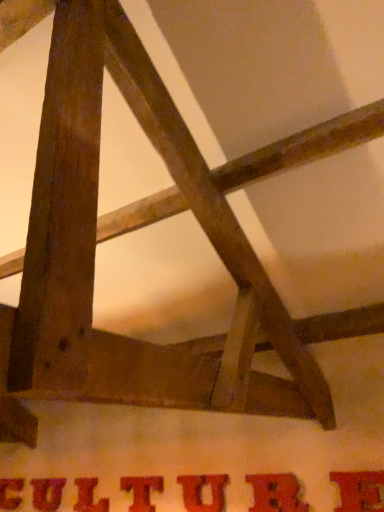
Find the location of a particular element. This screenshot has height=512, width=384. matte red letter at center, which is the sixth letter from left to right is located at coordinates (276, 493).

Measure the distance between point (228, 478) and camera.

Point (228, 478) and camera are 8.71 feet apart from each other.

The width and height of the screenshot is (384, 512). I want to click on matte brown letter t at center, which appears as the 4th letter when viewed from the right, so click(x=142, y=490).

In the scene shown: Measure the distance between point (81,508) and camera.

The depth of point (81,508) is 3.16 meters.

At what (x,y) coordinates should I click in order to perform the action: click on matte red letter at center, marked as the second letter in a left-to-right arrangement. Please return your answer as a coordinate pair (x, y). Looking at the image, I should click on (47, 493).

This screenshot has height=512, width=384. What are the coordinates of `matte red letter at center, which is the sixth letter from left to right` in the screenshot? It's located at (276, 493).

Looking at their sizes, would you say matte brown letter at center, arranged as the 7th letter when viewed from the right, is wider or thinner than matte red letter at center, which is the sixth letter from left to right?

In the image, matte brown letter at center, arranged as the 7th letter when viewed from the right, appears to be wider than matte red letter at center, which is the sixth letter from left to right.

How many degrees apart are the facing directions of matte brown letter at center, which is the first letter from left to right, and matte red letter at center, which is the second letter in right-to-left order?

0.00771 degrees.

From the image's perspective, which letter is the 5th one below the matte red letter at center, which is the second letter in right-to-left order? Please provide its 2D coordinates.

[(10, 493)]

Can you see matte red letter at lower right, positioned as the seventh letter in left-to-right order, touching matte brown letter t at center, the 4th letter in the left-to-right sequence?

No, matte red letter at lower right, positioned as the seventh letter in left-to-right order, is not beside matte brown letter t at center, the 4th letter in the left-to-right sequence.

Choose the correct answer: Is matte red letter at lower right, which is the 1th letter from right to left, inside matte brown letter t at center, which appears as the 4th letter when viewed from the right, or outside it?

matte red letter at lower right, which is the 1th letter from right to left, is outside matte brown letter t at center, which appears as the 4th letter when viewed from the right.

In terms of height, does matte red letter at lower right, which is the 1th letter from right to left, look taller or shorter compared to matte brown letter t at center, which appears as the 4th letter when viewed from the right?

In the image, matte red letter at lower right, which is the 1th letter from right to left, appears to be taller than matte brown letter t at center, which appears as the 4th letter when viewed from the right.

Can you tell me how much matte red letter at lower right, which is the 1th letter from right to left, and matte brown letter t at center, the 4th letter in the left-to-right sequence, differ in facing direction?

The facing directions of matte red letter at lower right, which is the 1th letter from right to left, and matte brown letter t at center, the 4th letter in the left-to-right sequence, are 0.00142 degrees apart.

Can you tell me how much matte red letter at center, the sixth letter positioned from the right, and matte brown letter t at center, which appears as the 4th letter when viewed from the right, differ in facing direction?

The facing directions of matte red letter at center, the sixth letter positioned from the right, and matte brown letter t at center, which appears as the 4th letter when viewed from the right, are 0.00757 degrees apart.

Which object is wider, matte red letter at center, marked as the second letter in a left-to-right arrangement, or matte brown letter t at center, which appears as the 4th letter when viewed from the right?

With larger width is matte brown letter t at center, which appears as the 4th letter when viewed from the right.

Locate an element on the screen. Image resolution: width=384 pixels, height=512 pixels. letter that is the 2nd object located below the matte brown letter t at center, the 4th letter in the left-to-right sequence (from the image's perspective) is located at coordinates point(47,493).

Is matte red letter at center, the sixth letter positioned from the right, turned away from matte brown letter t at center, which appears as the 4th letter when viewed from the right?

That's not correct — matte red letter at center, the sixth letter positioned from the right, is not looking away from matte brown letter t at center, which appears as the 4th letter when viewed from the right.

Is matte red letter at center, marked as the second letter in a left-to-right arrangement, wider than matte brown letter at center, which is the first letter from left to right?

No.

What's the angular difference between matte red letter at center, marked as the second letter in a left-to-right arrangement, and matte brown letter at center, arranged as the 7th letter when viewed from the right,'s facing directions?

There is a 0.0129-degree angle between the facing directions of matte red letter at center, marked as the second letter in a left-to-right arrangement, and matte brown letter at center, arranged as the 7th letter when viewed from the right.

Would you say matte red letter at center, marked as the second letter in a left-to-right arrangement, is to the left or to the right of matte brown letter at center, arranged as the 7th letter when viewed from the right, in the picture?

Clearly, matte red letter at center, marked as the second letter in a left-to-right arrangement, is on the right of matte brown letter at center, arranged as the 7th letter when viewed from the right, in the image.

From a real-world perspective, is matte red letter at center, marked as the second letter in a left-to-right arrangement, located beneath matte brown letter at center, arranged as the 7th letter when viewed from the right?

No, from a real-world perspective, matte red letter at center, marked as the second letter in a left-to-right arrangement, is not under matte brown letter at center, arranged as the 7th letter when viewed from the right.

Can you confirm if matte brown letter at center, which is the first letter from left to right, is shorter than matte brown letter t at center, which appears as the 4th letter when viewed from the right?

Yes, matte brown letter at center, which is the first letter from left to right, is shorter than matte brown letter t at center, which appears as the 4th letter when viewed from the right.

From the image's perspective, would you say matte brown letter at center, which is the first letter from left to right, is positioned over matte brown letter t at center, the 4th letter in the left-to-right sequence?

Actually, matte brown letter at center, which is the first letter from left to right, appears below matte brown letter t at center, the 4th letter in the left-to-right sequence, in the image.

Based on the photo, is matte brown letter at center, which is the first letter from left to right, far away from matte brown letter t at center, the 4th letter in the left-to-right sequence?

Yes, matte brown letter at center, which is the first letter from left to right, and matte brown letter t at center, the 4th letter in the left-to-right sequence, are located far from each other.

From a real-world perspective, is matte brown letter at center, which is the first letter from left to right, on matte brown letter t at center, the 4th letter in the left-to-right sequence?

No, from a real-world perspective, matte brown letter at center, which is the first letter from left to right, is not on top of matte brown letter t at center, the 4th letter in the left-to-right sequence.

Based on the photo, from the image's perspective, who appears lower, matte red letter at center, which is the sixth letter from left to right, or matte brown letter t at center, the 4th letter in the left-to-right sequence?

matte brown letter t at center, the 4th letter in the left-to-right sequence.

Starting from the matte red letter at center, which is the sixth letter from left to right, which letter is the 2nd one behind? Please provide its 2D coordinates.

[(142, 490)]

Can you confirm if matte red letter at center, which is the sixth letter from left to right, is smaller than matte brown letter t at center, which appears as the 4th letter when viewed from the right?

No, matte red letter at center, which is the sixth letter from left to right, is not smaller than matte brown letter t at center, which appears as the 4th letter when viewed from the right.

Is matte red letter at center, which is the sixth letter from left to right, thinner than matte brown letter t at center, the 4th letter in the left-to-right sequence?

In fact, matte red letter at center, which is the sixth letter from left to right, might be wider than matte brown letter t at center, the 4th letter in the left-to-right sequence.

Looking at the image, does matte red letter at center, which is the third letter in right-to-left order, seem bigger or smaller compared to matte brown letter at center, which is the first letter from left to right?

Considering their sizes, matte red letter at center, which is the third letter in right-to-left order, takes up more space than matte brown letter at center, which is the first letter from left to right.

Based on the photo, how far apart are matte red letter at center, which is counted as the fifth letter, starting from the left, and matte brown letter at center, arranged as the 7th letter when viewed from the right?

matte red letter at center, which is counted as the fifth letter, starting from the left, is 5.61 feet away from matte brown letter at center, arranged as the 7th letter when viewed from the right.

What's the angular difference between matte red letter at center, which is the third letter in right-to-left order, and matte brown letter at center, which is the first letter from left to right,'s facing directions?

The angular difference between matte red letter at center, which is the third letter in right-to-left order, and matte brown letter at center, which is the first letter from left to right, is 0.00771 degrees.

Based on the photo, between matte red letter at center, which is the third letter in right-to-left order, and matte brown letter at center, arranged as the 7th letter when viewed from the right, which one has smaller width?

matte red letter at center, which is the third letter in right-to-left order, is thinner.

Which letter is the 5th one when counting from the back of the matte red letter at center, which is the sixth letter from left to right? Please provide its 2D coordinates.

[(10, 493)]

Identify the location of letter that is the 3rd one above the matte red letter at lower right, positioned as the seventh letter in left-to-right order (from a real-world perspective). The image size is (384, 512). (142, 490).

From the picture: Based on their spatial positions, is matte brown letter at center, arranged as the 7th letter when viewed from the right, or matte red letter at center, which is the third letter in left-to-right order, further from matte red letter at center, which is counted as the fifth letter, starting from the left?

matte brown letter at center, arranged as the 7th letter when viewed from the right, lies further to matte red letter at center, which is counted as the fifth letter, starting from the left, than the other object.

Looking at the image, which one is located closer to matte red letter at center, marked as the second letter in a left-to-right arrangement, matte red letter at center, which is the second letter in right-to-left order, or matte brown letter t at center, which appears as the 4th letter when viewed from the right?

Based on the image, matte brown letter t at center, which appears as the 4th letter when viewed from the right, appears to be nearer to matte red letter at center, marked as the second letter in a left-to-right arrangement.

Looking at the image, which one is located further to matte red letter at center, which is the third letter in right-to-left order, matte red letter at center, which is the third letter in left-to-right order, or matte red letter at center, which is the second letter in right-to-left order?

Based on the image, matte red letter at center, which is the third letter in left-to-right order, appears to be further to matte red letter at center, which is the third letter in right-to-left order.

Considering their positions, is matte brown letter at center, which is the first letter from left to right, positioned closer to matte red letter at lower right, which is the 1th letter from right to left, than matte red letter at center, which is counted as the fifth letter, starting from the left?

matte red letter at center, which is counted as the fifth letter, starting from the left, is positioned closer to the anchor matte red letter at lower right, which is the 1th letter from right to left.

Which object lies nearer to the anchor point matte red letter at lower right, which is the 1th letter from right to left, matte brown letter at center, arranged as the 7th letter when viewed from the right, or matte red letter at center, which is the sixth letter from left to right?

Among the two, matte red letter at center, which is the sixth letter from left to right, is located nearer to matte red letter at lower right, which is the 1th letter from right to left.

Which object lies further to the anchor point matte red letter at center, marked as the second letter in a left-to-right arrangement, matte brown letter t at center, the 4th letter in the left-to-right sequence, or matte brown letter at center, arranged as the 7th letter when viewed from the right?

Based on the image, matte brown letter t at center, the 4th letter in the left-to-right sequence, appears to be further to matte red letter at center, marked as the second letter in a left-to-right arrangement.

Consider the image. From the image, which object appears to be farther from matte brown letter at center, which is the first letter from left to right, matte red letter at center, the sixth letter positioned from the right, or matte red letter at center, marked as the fifth letter in a right-to-left arrangement?

The object further to matte brown letter at center, which is the first letter from left to right, is matte red letter at center, marked as the fifth letter in a right-to-left arrangement.

From the image, which object appears to be nearer to matte brown letter t at center, the 4th letter in the left-to-right sequence, matte red letter at center, marked as the fifth letter in a right-to-left arrangement, or matte red letter at center, which is the second letter in right-to-left order?

Based on the image, matte red letter at center, marked as the fifth letter in a right-to-left arrangement, appears to be nearer to matte brown letter t at center, the 4th letter in the left-to-right sequence.

The width and height of the screenshot is (384, 512). I want to click on letter between matte red letter at center, marked as the second letter in a left-to-right arrangement, and matte brown letter t at center, the 4th letter in the left-to-right sequence, from left to right, so click(89, 496).

I want to click on letter located between matte red letter at center, which is the third letter in right-to-left order, and matte red letter at lower right, which is the 1th letter from right to left, in the left-right direction, so click(x=276, y=493).

The image size is (384, 512). Identify the location of letter between matte brown letter t at center, which appears as the 4th letter when viewed from the right, and matte red letter at center, which is the sixth letter from left to right, from left to right. 203,492.

This screenshot has width=384, height=512. Identify the location of letter situated between matte red letter at center, which is the third letter in left-to-right order, and matte red letter at center, which is the third letter in right-to-left order, from left to right. (142, 490).